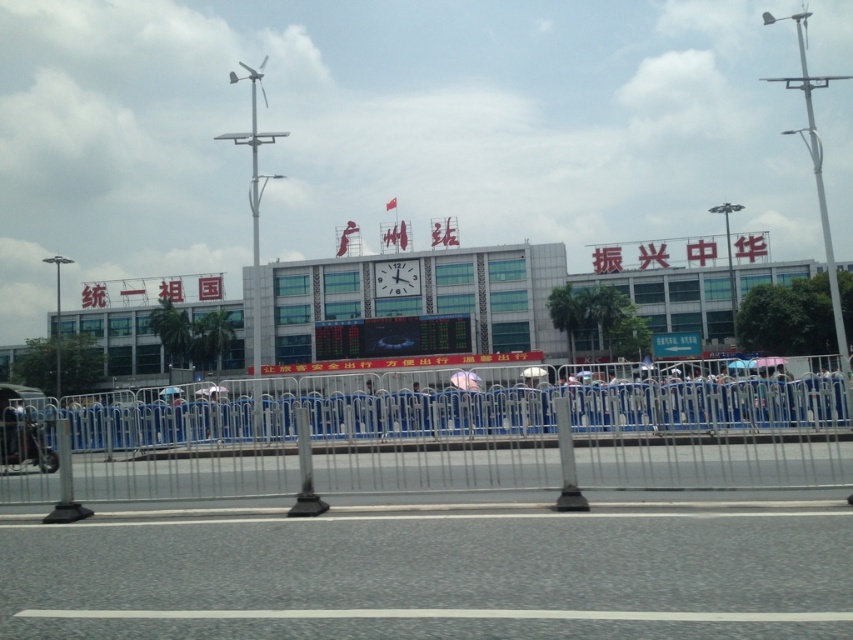
Which is below, white glossy clock at center or transparent plastic umbrella at center?

transparent plastic umbrella at center

In the scene shown: Can you confirm if white glossy clock at center is bigger than transparent plastic umbrella at center?

Correct, white glossy clock at center is larger in size than transparent plastic umbrella at center.

Does point (405, 260) come farther from viewer compared to point (456, 378)?

Yes, it is.

The height and width of the screenshot is (640, 853). In order to click on white glossy clock at center in this screenshot , I will do `click(396, 278)`.

Who is positioned more to the right, metallic blue fence at center or pink fabric umbrella at center?

metallic blue fence at center

What do you see at coordinates (468, 440) in the screenshot? Image resolution: width=853 pixels, height=640 pixels. I see `metallic blue fence at center` at bounding box center [468, 440].

You are a GUI agent. You are given a task and a screenshot of the screen. Output one action in this format:
    pyautogui.click(x=<x>, y=<y>)
    Task: Click on the metallic blue fence at center
    
    Given the screenshot: What is the action you would take?
    pyautogui.click(x=468, y=440)

Who is lower down, white glossy clock at center or pink fabric umbrella at center?

pink fabric umbrella at center is lower down.

Is white glossy clock at center thinner than pink fabric umbrella at center?

Incorrect, white glossy clock at center's width is not less than pink fabric umbrella at center's.

The width and height of the screenshot is (853, 640). Find the location of `white glossy clock at center`. white glossy clock at center is located at coordinates (396, 278).